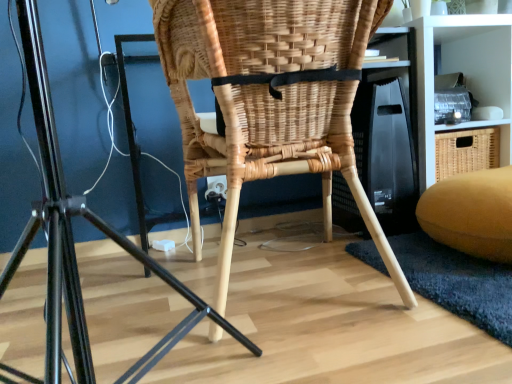
Find the location of `vacant region to the left of natural woven chair at center`. vacant region to the left of natural woven chair at center is located at coordinates (115, 297).